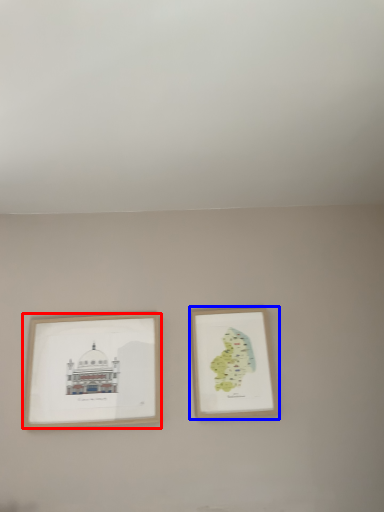
Question: Among these objects, which one is farthest to the camera, picture frame (highlighted by a red box) or picture frame (highlighted by a blue box)?

Choices:
 (A) picture frame
 (B) picture frame

Answer: (B)